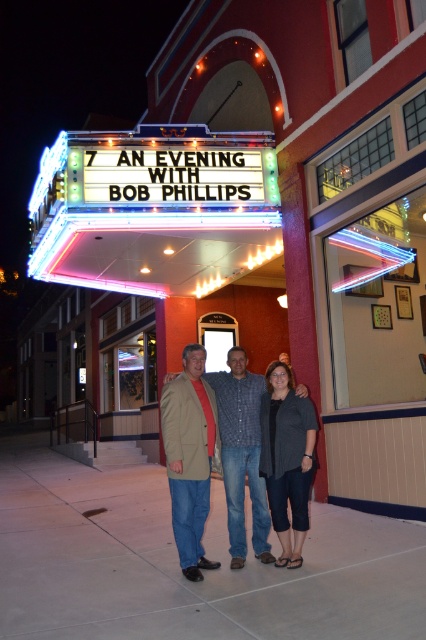
Is the position of matte black jacket at center less distant than that of dark gray textured blazer at center?

No, it is not.

Does matte black jacket at center appear on the left side of dark gray textured blazer at center?

Yes, matte black jacket at center is to the left of dark gray textured blazer at center.

At what (x,y) coordinates should I click in order to perform the action: click on matte black jacket at center. Please return your answer as a coordinate pair (x, y). Looking at the image, I should click on (241, 452).

Looking at this image, measure the distance between beige fabric jacket at center and camera.

beige fabric jacket at center is 4.65 meters from camera.

From the picture: Can you confirm if beige fabric jacket at center is taller than dark gray textured blazer at center?

Yes, beige fabric jacket at center is taller than dark gray textured blazer at center.

Is point (192, 392) behind point (294, 502)?

Yes, it is behind point (294, 502).

This screenshot has width=426, height=640. In order to click on beige fabric jacket at center in this screenshot , I will do `click(189, 458)`.

Is neontexturedmarquee sign at upper center further to camera compared to beige fabric jacket at center?

Yes, it is behind beige fabric jacket at center.

Between neontexturedmarquee sign at upper center and beige fabric jacket at center, which one has less height?

neontexturedmarquee sign at upper center

Does point (164, 200) lie in front of point (184, 358)?

That is False.

The height and width of the screenshot is (640, 426). Find the location of `neontexturedmarquee sign at upper center`. neontexturedmarquee sign at upper center is located at coordinates (155, 209).